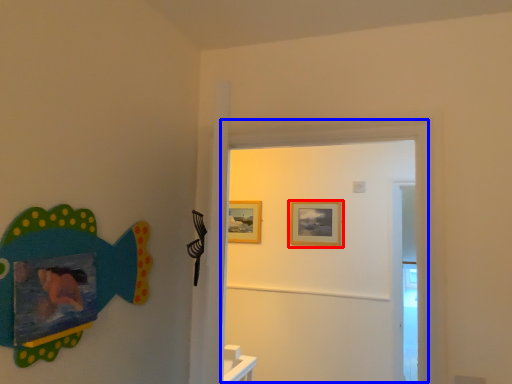
Question: Which object is closer to the camera taking this photo, picture frame (highlighted by a red box) or door (highlighted by a blue box)?

Choices:
 (A) picture frame
 (B) door

Answer: (B)